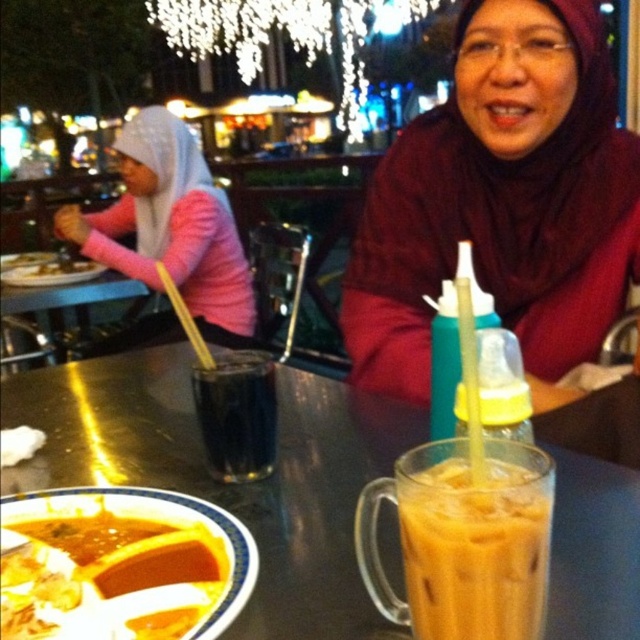
Question: Which of the following is the farthest from the observer?

Choices:
 (A) smooth orange soup at lower left
 (B) black glass at center
 (C) iced yellowish-brown liquid at lower center
 (D) metallic table at center

Answer: (B)

Question: Does pink fabric hijab at upper left have a larger size compared to smooth orange soup at lower left?

Choices:
 (A) yes
 (B) no

Answer: (A)

Question: Is smooth orange soup at lower left wider than black glass at center?

Choices:
 (A) no
 (B) yes

Answer: (B)

Question: Is iced yellowish-brown liquid at lower center in front of black glass at center?

Choices:
 (A) no
 (B) yes

Answer: (B)

Question: Which of these objects is positioned closest to the smooth orange soup at lower left?

Choices:
 (A) pink fabric hijab at upper left
 (B) maroon fabric hijab at upper center
 (C) iced yellowish-brown liquid at lower center
 (D) metallic table at center

Answer: (C)

Question: Which of the following is the closest to the observer?

Choices:
 (A) (168, 148)
 (B) (17, 625)
 (C) (147, 467)

Answer: (B)